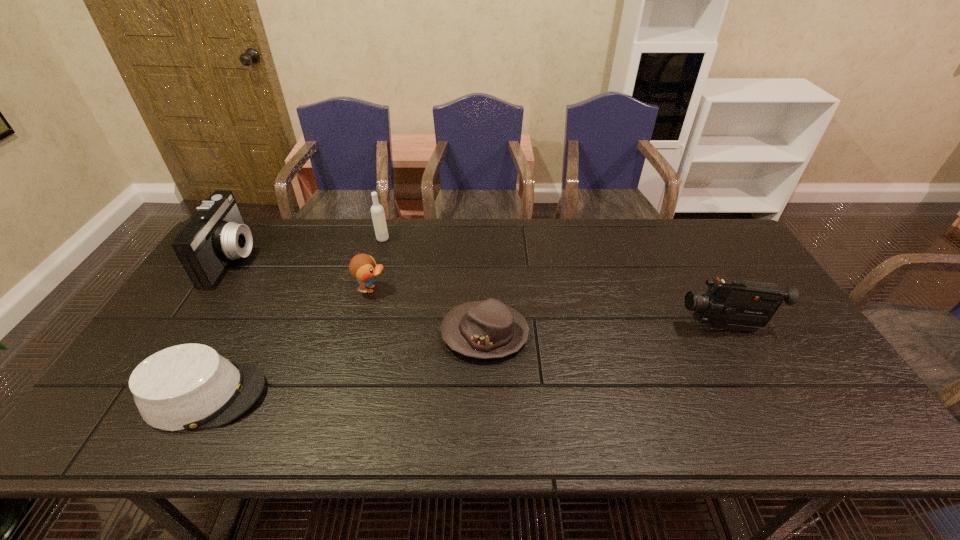
The image size is (960, 540). What are the coordinates of `blank space located 0.080m on the front-facing side of the nearer camcorder` in the screenshot? It's located at (648, 327).

The width and height of the screenshot is (960, 540). I want to click on vacant space situated 0.360m on the front-facing side of the nearer camcorder, so click(546, 327).

Find the location of `free space located 0.050m on the front-facing side of the fourth tallest object`. free space located 0.050m on the front-facing side of the fourth tallest object is located at coordinates (404, 289).

You are a GUI agent. You are given a task and a screenshot of the screen. Output one action in this format:
    pyautogui.click(x=<x>, y=<y>)
    Task: Click on the free space located 0.200m on the front-facing side of the left hat
    
    Given the screenshot: What is the action you would take?
    [349, 395]

The image size is (960, 540). What are the coordinates of `vacant space located 0.260m on the decorative side of the right hat` in the screenshot? It's located at (345, 334).

Where is `free space located on the decorative side of the right hat`? The width and height of the screenshot is (960, 540). free space located on the decorative side of the right hat is located at coordinates (300, 334).

The height and width of the screenshot is (540, 960). Identify the location of vacant region located 0.170m on the decorative side of the right hat. (377, 334).

In order to click on vodka that is at the far edge in this screenshot , I will do `click(377, 211)`.

The image size is (960, 540). I want to click on camcorder situated at the far edge, so click(216, 232).

Where is `object that is at the near edge`? object that is at the near edge is located at coordinates (190, 386).